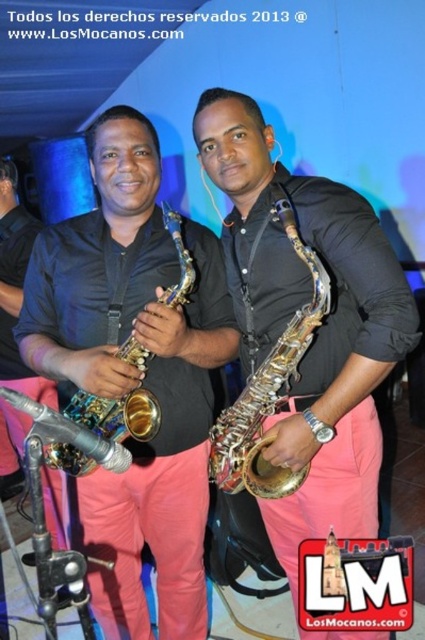
You are a stagehand setting up for a performance. You need to place a 12 inch wide music stand between the satin gold saxophone at center and the brushed metal saxophone at center. Based on the scene, will the music stand fit between them?

The distance between the satin gold saxophone at center and the brushed metal saxophone at center is 14.26 inches. Since the music stand is 12 inches wide, it will fit between them with some space to spare.

You are a photographer at a concert. You need to capture a photo of both the satin gold saxophone at center and the gold metallic saxophone at center. Which saxophone should you focus on first if you want to include both in your frame without moving the camera?

The satin gold saxophone at center is positioned on the right side of the gold metallic saxophone at center, so you should focus on the gold metallic saxophone at center first to ensure both are in frame.

You are a stagehand setting up for a performance. You have two saxophones, the satin gold saxophone at center and the gold metallic saxophone at center. The stage has a narrow stand that can only accommodate a saxophone with a width of 20 cm. Which saxophone should you choose to ensure it fits on the stand?

The gold metallic saxophone at center should be chosen because the satin gold saxophone at center might be wider than the gold metallic saxophone at center, exceeding the stand width limit.